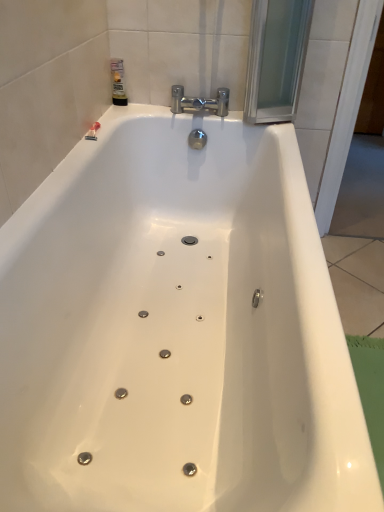
Question: Considering the relative positions of chrome/metallic faucet at upper center and translucent plastic bottle at upper left in the image provided, is chrome/metallic faucet at upper center to the right of translucent plastic bottle at upper left from the viewer's perspective?

Choices:
 (A) no
 (B) yes

Answer: (B)

Question: Considering the relative positions of chrome/metallic faucet at upper center and translucent plastic bottle at upper left in the image provided, is chrome/metallic faucet at upper center in front of translucent plastic bottle at upper left?

Choices:
 (A) no
 (B) yes

Answer: (B)

Question: From the image's perspective, is chrome/metallic faucet at upper center located above translucent plastic bottle at upper left?

Choices:
 (A) yes
 (B) no

Answer: (B)

Question: Is chrome/metallic faucet at upper center next to translucent plastic bottle at upper left?

Choices:
 (A) yes
 (B) no

Answer: (B)

Question: Is chrome/metallic faucet at upper center taller than translucent plastic bottle at upper left?

Choices:
 (A) no
 (B) yes

Answer: (A)

Question: From a real-world perspective, is chrome/metallic faucet at upper center below translucent plastic bottle at upper left?

Choices:
 (A) yes
 (B) no

Answer: (A)

Question: Is translucent plastic bottle at upper left wider than chrome/metallic faucet at upper center?

Choices:
 (A) no
 (B) yes

Answer: (A)

Question: Can chrome/metallic faucet at upper center be found inside translucent plastic bottle at upper left?

Choices:
 (A) yes
 (B) no

Answer: (B)

Question: Does translucent plastic bottle at upper left turn towards chrome/metallic faucet at upper center?

Choices:
 (A) yes
 (B) no

Answer: (A)

Question: Does translucent plastic bottle at upper left have a lesser width compared to chrome/metallic faucet at upper center?

Choices:
 (A) yes
 (B) no

Answer: (A)

Question: Is translucent plastic bottle at upper left far from chrome/metallic faucet at upper center?

Choices:
 (A) no
 (B) yes

Answer: (A)

Question: From a real-world perspective, is translucent plastic bottle at upper left located beneath chrome/metallic faucet at upper center?

Choices:
 (A) yes
 (B) no

Answer: (B)

Question: Is translucent plastic bottle at upper left wider or thinner than chrome/metallic faucet at upper center?

Choices:
 (A) wide
 (B) thin

Answer: (B)